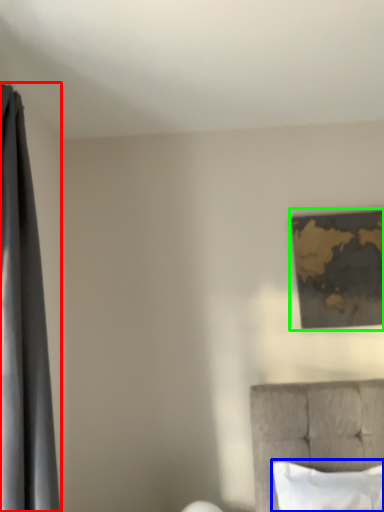
Question: Considering the real-world distances, which object is farthest from curtain (highlighted by a red box)? pillow (highlighted by a blue box) or picture frame (highlighted by a green box)?

Choices:
 (A) pillow
 (B) picture frame

Answer: (B)